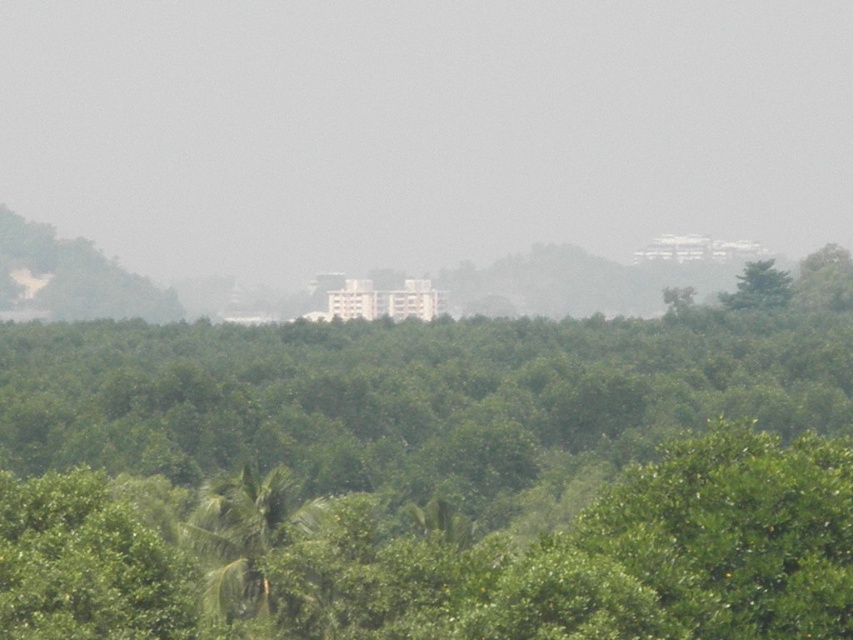
You are standing in the middle of the green leafy forest at center. Looking around, you notice the cluster of buildings in the midground. In which direction relative to your position are the buildings located?

The cluster of buildings are located in the midground, which is behind the green leafy forest at center. Since you are standing in the middle of the green leafy forest at center, the buildings would be behind you.

Looking at this image, you are a hiker trying to navigate through the green leafy forest at center and the green leafy tree at upper right. Which one would you need to walk around to avoid getting lost?

The green leafy forest at center is bigger than the green leafy tree at upper right, so you would need to walk around the green leafy forest at center to avoid getting lost.